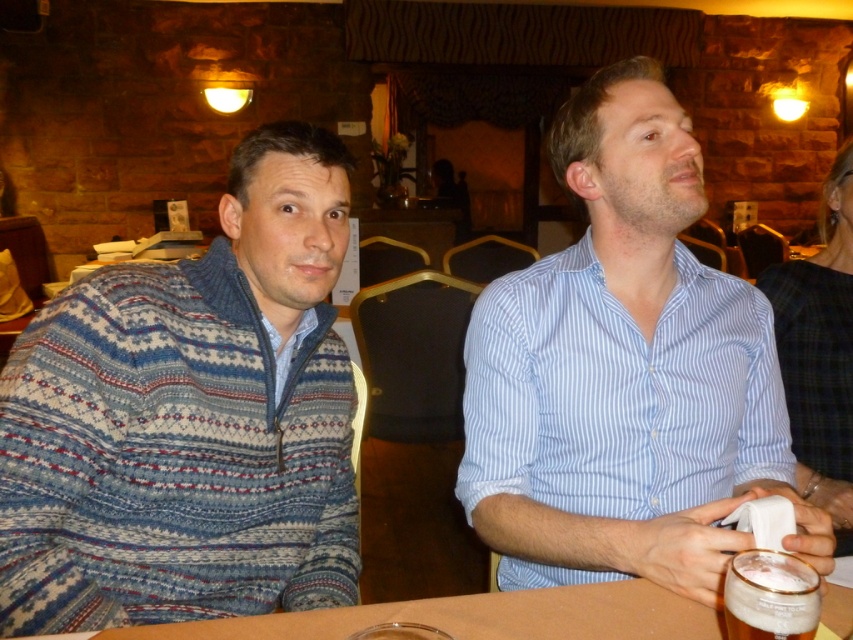
Question: Considering the relative positions of blue striped shirt at center and foamy white beer at lower right in the image provided, where is blue striped shirt at center located with respect to foamy white beer at lower right?

Choices:
 (A) above
 (B) below

Answer: (A)

Question: Which object is farther from the camera taking this photo?

Choices:
 (A) blue striped shirt at center
 (B) brown wooden table at center

Answer: (A)

Question: Considering the real-world distances, which object is closest to the brown wooden table at center?

Choices:
 (A) blue striped shirt at center
 (B) foamy white beer at lower right
 (C) knitted sweater at left

Answer: (B)

Question: Does knitted sweater at left have a greater width compared to brown wooden table at center?

Choices:
 (A) yes
 (B) no

Answer: (B)

Question: Among these objects, which one is farthest from the camera?

Choices:
 (A) knitted sweater at left
 (B) foamy white beer at lower right
 (C) brown wooden table at center
 (D) blue striped shirt at center

Answer: (A)

Question: Does knitted sweater at left have a greater width compared to foamy white beer at lower right?

Choices:
 (A) yes
 (B) no

Answer: (A)